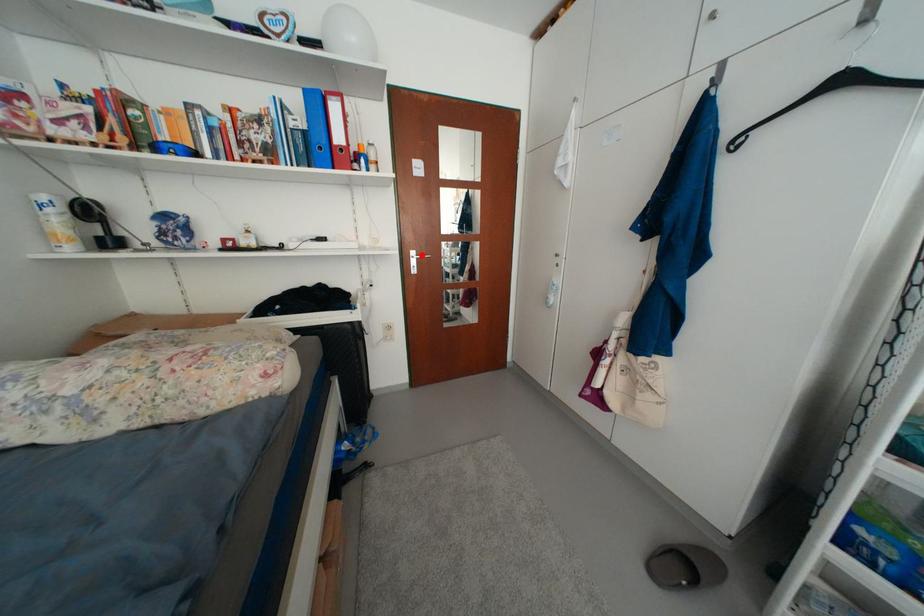
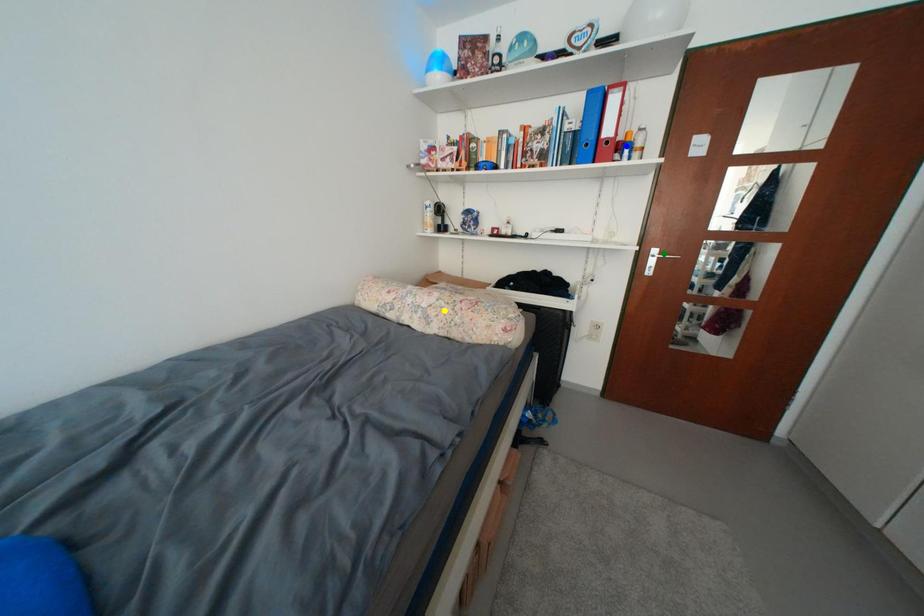
Question: I am providing you with two images of the same scene from different viewpoints. A red point is marked on the first image. You are given multiple points on the second image. Which point in image 2 represents the same 3d spot as the red point in image 1?

Choices:
 (A) yellow point
 (B) green point
 (C) blue point

Answer: (B)